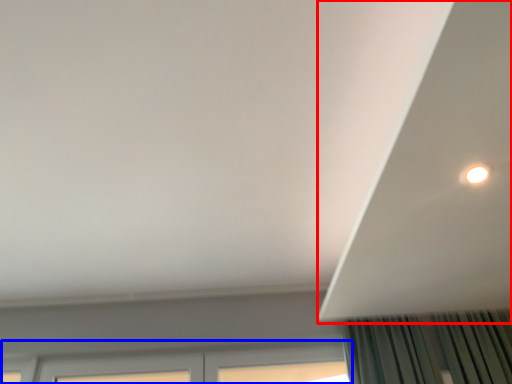
Question: Which object is closer to the camera taking this photo, exhaust hood (highlighted by a red box) or window (highlighted by a blue box)?

Choices:
 (A) exhaust hood
 (B) window

Answer: (A)